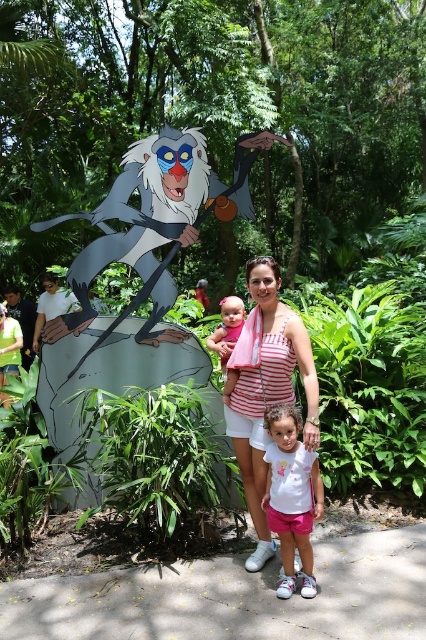
Between point (247, 177) and point (294, 364), which one is positioned behind?

The point (247, 177) is behind.

Is point (109, 248) positioned after point (236, 376)?

Yes, point (109, 248) is farther from viewer.

Does point (222, 205) lie behind point (311, 376)?

Yes, it is behind point (311, 376).

Find the location of a particular element. The height and width of the screenshot is (640, 426). gray plastic figure at left is located at coordinates click(x=155, y=221).

Can you confirm if white matte shirt at center is positioned above matte pink dress at center?

Incorrect, white matte shirt at center is not positioned above matte pink dress at center.

Which is above, white matte shirt at center or matte pink dress at center?

matte pink dress at center is higher up.

Between point (285, 508) and point (224, 310), which one is positioned behind?

Positioned behind is point (224, 310).

Find the location of a particular element. Image resolution: width=426 pixels, height=640 pixels. white matte shirt at center is located at coordinates (291, 497).

Does point (252, 461) come in front of point (310, 480)?

No, it is not.

Who is taller, white striped tank top at center or white matte shirt at center?

With more height is white striped tank top at center.

Identify the location of white striped tank top at center. This screenshot has height=640, width=426. (265, 388).

Find the location of a particular element. white striped tank top at center is located at coordinates (265, 388).